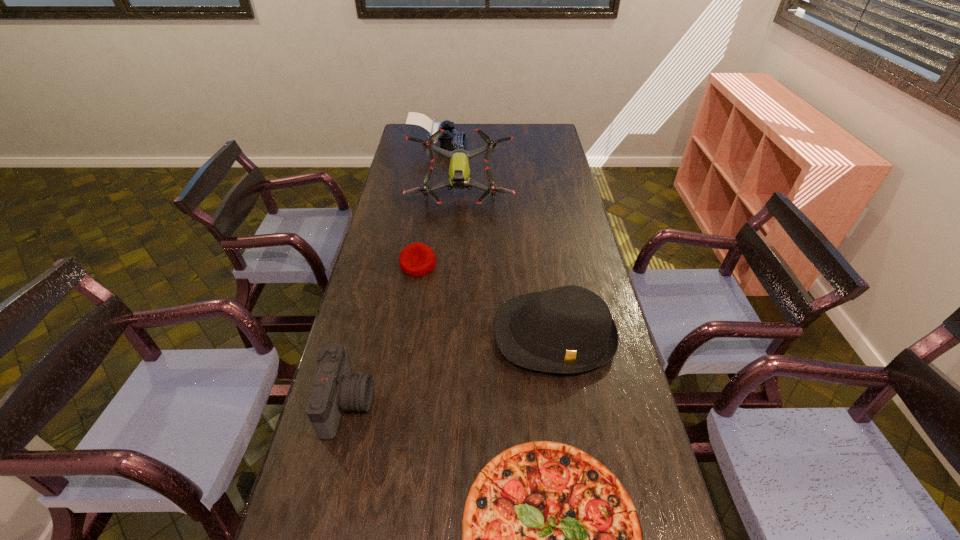
What are the coordinates of `drone` in the screenshot? It's located at (459, 171).

Identify the location of the second farthest object. Image resolution: width=960 pixels, height=540 pixels. (459, 171).

Identify the location of fedora. (569, 329).

Locate an element on the screen. The width and height of the screenshot is (960, 540). the farthest object is located at coordinates (449, 140).

Where is `camera`? The image size is (960, 540). camera is located at coordinates (335, 389).

Identify the location of beanbag. (417, 259).

Where is `the fifth tallest object`? The image size is (960, 540). the fifth tallest object is located at coordinates (x=417, y=259).

In order to click on free space located 0.240m on the front-facing side of the fifth nearest object in this screenshot , I will do `click(457, 250)`.

The width and height of the screenshot is (960, 540). Find the location of `vacant region located on the front-facing side of the fedora`. vacant region located on the front-facing side of the fedora is located at coordinates (581, 502).

Locate an element on the screen. This screenshot has height=540, width=960. vacant space located on the keys of the farthest object is located at coordinates [x=512, y=145].